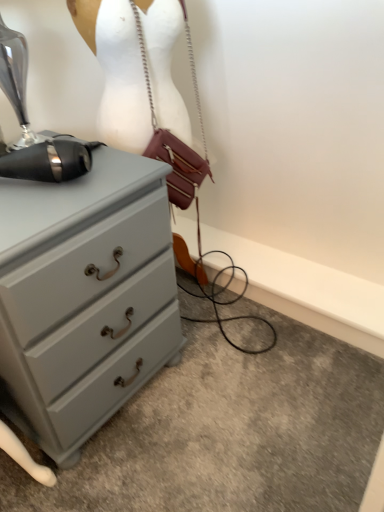
Where is `free spot in front of white matte mannequin at upper center`? Image resolution: width=384 pixels, height=512 pixels. free spot in front of white matte mannequin at upper center is located at coordinates (200, 339).